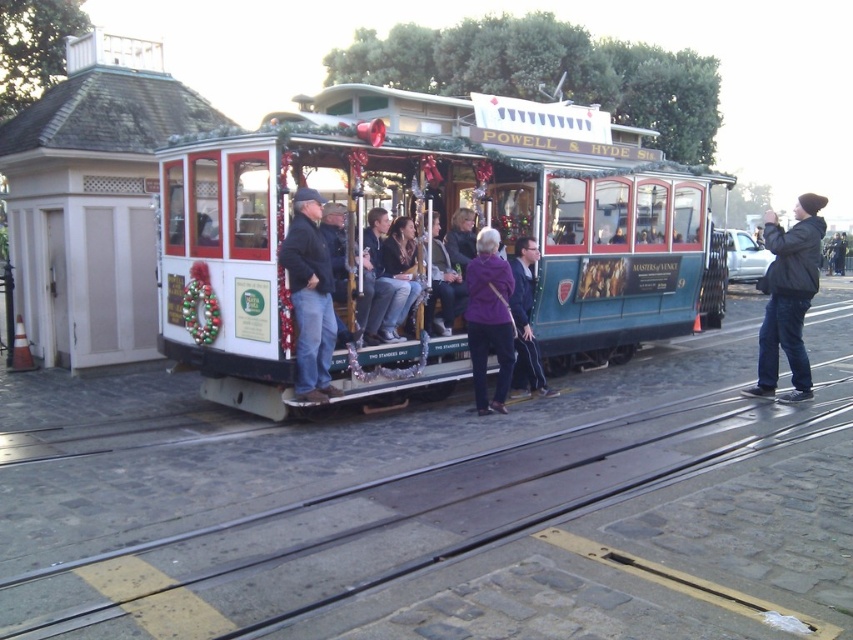
Question: Does metal train track at center appear under polished wood cable car at center?

Choices:
 (A) no
 (B) yes

Answer: (B)

Question: Which of the following is the closest to the observer?

Choices:
 (A) (772, 442)
 (B) (817, 236)
 (C) (503, 400)

Answer: (A)

Question: Which object is positioned closest to the purple fabric coat at center?

Choices:
 (A) metal train track at center
 (B) polished wood cable car at center

Answer: (B)

Question: Is polished wood cable car at center smaller than denim jacket at center?

Choices:
 (A) no
 (B) yes

Answer: (A)

Question: Can you confirm if polished wood cable car at center is positioned above matte black jacket at center?

Choices:
 (A) yes
 (B) no

Answer: (A)

Question: Which point is closer to the camera?

Choices:
 (A) matte black jacket at center
 (B) black leather jacket at right

Answer: (B)